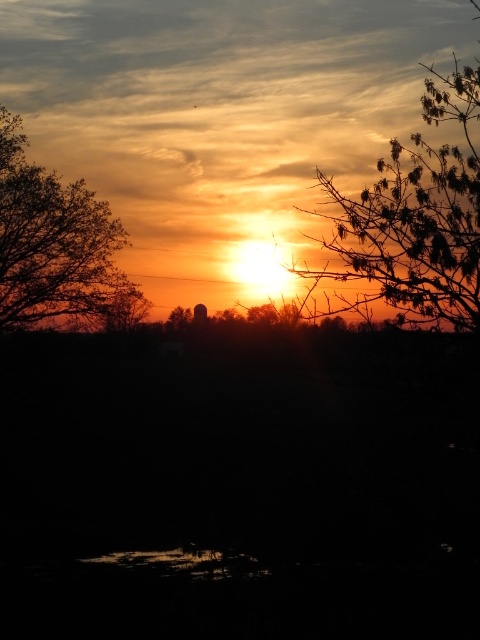
You are an artist trying to paint the sunset scene. You want to place the silhouetted leafy branch at upper right and the silhouetted leafy tree at left in your painting. Which object should you paint first if you follow the standard painting technique of painting background elements before foreground elements?

The silhouetted leafy tree at left should be painted first because it is positioned in the foreground, while the silhouetted leafy branch at upper right is in the background. Following standard painting techniques, background elements are painted first to allow proper layering.

You are an artist trying to paint the sunset scene. You notice the silhouetted leafy branch at upper right and the silhouetted leafy tree at left. Which one is positioned lower in the image?

The silhouetted leafy branch at upper right is positioned lower than the silhouetted leafy tree at left.

You are an artist trying to sketch this sunset scene. You notice two silhouettes in the foreground. Which one should you draw first if you want to ensure proper perspective, the silhouetted leafy branch at upper right or the silhouetted leafy tree at left?

The silhouetted leafy tree at left should be drawn first because it is closer to the viewer, allowing you to establish the foreground before adding elements further away like the larger branch.